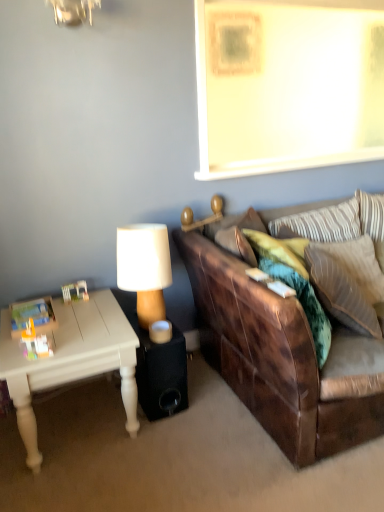
Locate an element on the screen. white painted wood coffee table at lower left is located at coordinates (71, 360).

The width and height of the screenshot is (384, 512). What do you see at coordinates (71, 360) in the screenshot?
I see `white painted wood coffee table at lower left` at bounding box center [71, 360].

This screenshot has width=384, height=512. What do you see at coordinates (323, 223) in the screenshot?
I see `striped fabric pillow at upper right, the 1th pillow positioned from the back` at bounding box center [323, 223].

You are a GUI agent. You are given a task and a screenshot of the screen. Output one action in this format:
    pyautogui.click(x=<x>, y=<y>)
    Task: Click on the velvet green pillow at right, the second pillow from the back
    The height and width of the screenshot is (512, 384).
    Given the screenshot: What is the action you would take?
    pyautogui.click(x=348, y=282)

Where is `wooden lampshade at center, the 2th lamp when ordered from right to left`? wooden lampshade at center, the 2th lamp when ordered from right to left is located at coordinates (145, 268).

Locate an element on the screen. This screenshot has width=384, height=512. lamp behind the black fabric speaker at lower center is located at coordinates (204, 218).

Is black fabric speaker at lower center positioned before wooden lampshade at upper center, the first lamp when ordered from top to bottom?

Yes, it is.

Who is smaller, black fabric speaker at lower center or wooden lampshade at upper center, the 2th lamp in the bottom-to-top sequence?

wooden lampshade at upper center, the 2th lamp in the bottom-to-top sequence.

From the image's perspective, is velvet green pillow at right, the second pillow from the back, below wooden lampshade at upper center, the 2th lamp in the bottom-to-top sequence?

Yes.

Based on their positions, is velvet green pillow at right, positioned as the second pillow in front-to-back order, located to the left or right of wooden lampshade at upper center, the first lamp when ordered from top to bottom?

Based on their positions, velvet green pillow at right, positioned as the second pillow in front-to-back order, is located to the right of wooden lampshade at upper center, the first lamp when ordered from top to bottom.

Is velvet green pillow at right, the second pillow from the back, in front of or behind wooden lampshade at upper center, which is the 1th lamp in right-to-left order, in the image?

Visually, velvet green pillow at right, the second pillow from the back, is located in front of wooden lampshade at upper center, which is the 1th lamp in right-to-left order.

Where is `the 1st pillow in front of the wooden lampshade at upper center, the first lamp when ordered from top to bottom, counting from the anchor's position`? The height and width of the screenshot is (512, 384). the 1st pillow in front of the wooden lampshade at upper center, the first lamp when ordered from top to bottom, counting from the anchor's position is located at coordinates (348, 282).

Is velvet green pillow at center, the third pillow from the back, aimed at wooden lampshade at upper center, the 2th lamp in the bottom-to-top sequence?

No, velvet green pillow at center, the third pillow from the back, is not aimed at wooden lampshade at upper center, the 2th lamp in the bottom-to-top sequence.

Considering the points (248, 233) and (222, 214), which point is behind, point (248, 233) or point (222, 214)?

The point (222, 214) is farther from the camera.

What's the angular difference between velvet green pillow at center, the third pillow from the back, and wooden lampshade at upper center, which is the 1th lamp in right-to-left order,'s facing directions?

The angular difference between velvet green pillow at center, the third pillow from the back, and wooden lampshade at upper center, which is the 1th lamp in right-to-left order, is 34.4 degrees.

How far apart are velvet green pillow at center, acting as the first pillow starting from the front, and wooden lampshade at upper center, which is the 1th lamp in right-to-left order?

The distance of velvet green pillow at center, acting as the first pillow starting from the front, from wooden lampshade at upper center, which is the 1th lamp in right-to-left order, is 20.26 inches.

Which object is thinner, wooden lampshade at center, the 2th lamp when ordered from right to left, or striped fabric pillow at upper right, the 3th pillow in the front-to-back sequence?

striped fabric pillow at upper right, the 3th pillow in the front-to-back sequence, is thinner.

From a real-world perspective, is wooden lampshade at center, the first lamp from the left, over striped fabric pillow at upper right, the 3th pillow in the front-to-back sequence?

Actually, wooden lampshade at center, the first lamp from the left, is physically below striped fabric pillow at upper right, the 3th pillow in the front-to-back sequence, in the real world.

From the image's perspective, which one is positioned lower, wooden lampshade at center, the first lamp from the left, or striped fabric pillow at upper right, the 1th pillow positioned from the back?

wooden lampshade at center, the first lamp from the left, from the image's perspective.

Which object is closer to the camera taking this photo, wooden lampshade at center, which is the 2th lamp from top to bottom, or striped fabric pillow at upper right, the 3th pillow in the front-to-back sequence?

wooden lampshade at center, which is the 2th lamp from top to bottom, is more forward.

Is velvet green pillow at center, acting as the first pillow starting from the front, placed right next to wooden lampshade at center, which is the 2th lamp from top to bottom?

No, velvet green pillow at center, acting as the first pillow starting from the front, is not beside wooden lampshade at center, which is the 2th lamp from top to bottom.

Considering the relative sizes of velvet green pillow at center, acting as the first pillow starting from the front, and wooden lampshade at center, which is the 2th lamp from top to bottom, in the image provided, is velvet green pillow at center, acting as the first pillow starting from the front, taller than wooden lampshade at center, which is the 2th lamp from top to bottom,?

Indeed, velvet green pillow at center, acting as the first pillow starting from the front, has a greater height compared to wooden lampshade at center, which is the 2th lamp from top to bottom.

Between velvet green pillow at center, acting as the first pillow starting from the front, and wooden lampshade at center, the first lamp from the left, which one is positioned in front?

velvet green pillow at center, acting as the first pillow starting from the front.

Can you confirm if velvet green pillow at center, the third pillow from the back, is wider than wooden lampshade at center, the first lamp from the left?

Correct, the width of velvet green pillow at center, the third pillow from the back, exceeds that of wooden lampshade at center, the first lamp from the left.

Which of these two, wooden lampshade at upper center, positioned as the second lamp in left-to-right order, or striped fabric pillow at upper right, the 3th pillow in the front-to-back sequence, is thinner?

wooden lampshade at upper center, positioned as the second lamp in left-to-right order, is thinner.

In the image, is wooden lampshade at upper center, positioned as the second lamp in left-to-right order, positioned in front of or behind striped fabric pillow at upper right, the 3th pillow in the front-to-back sequence?

wooden lampshade at upper center, positioned as the second lamp in left-to-right order, is positioned closer to the viewer than striped fabric pillow at upper right, the 3th pillow in the front-to-back sequence.

From a real-world perspective, between wooden lampshade at upper center, the 2th lamp in the bottom-to-top sequence, and striped fabric pillow at upper right, the 3th pillow in the front-to-back sequence, who is vertically lower?

striped fabric pillow at upper right, the 3th pillow in the front-to-back sequence, from a real-world perspective.

Does wooden lampshade at center, the first lamp from the left, have a greater width compared to white painted wood coffee table at lower left?

No.

Does wooden lampshade at center, which is the 2th lamp from top to bottom, appear on the right side of white painted wood coffee table at lower left?

Yes, wooden lampshade at center, which is the 2th lamp from top to bottom, is to the right of white painted wood coffee table at lower left.

In the scene shown: Considering the sizes of objects wooden lampshade at center, the first lamp from the left, and white painted wood coffee table at lower left in the image provided, who is shorter, wooden lampshade at center, the first lamp from the left, or white painted wood coffee table at lower left?

With less height is wooden lampshade at center, the first lamp from the left.

Can you tell me how much wooden lampshade at center, arranged as the 1th lamp when ordered from the bottom, and white painted wood coffee table at lower left differ in facing direction?

The angle between the facing direction of wooden lampshade at center, arranged as the 1th lamp when ordered from the bottom, and the facing direction of white painted wood coffee table at lower left is 1.58 degrees.

Find the location of `side table in front of the wooden lampshade at upper center, the first lamp when ordered from top to bottom`. side table in front of the wooden lampshade at upper center, the first lamp when ordered from top to bottom is located at coordinates (157, 366).

From the image's perspective, starting from the wooden lampshade at upper center, the 2th lamp in the bottom-to-top sequence, which pillow is the 2nd one below? Please provide its 2D coordinates.

[(348, 282)]

Considering their positions, is wooden lampshade at center, which is the 2th lamp from top to bottom, positioned closer to wooden lampshade at upper center, the 2th lamp in the bottom-to-top sequence, than velvet green pillow at right, the second pillow from the back?

wooden lampshade at center, which is the 2th lamp from top to bottom.

When comparing their distances from velvet green pillow at center, the third pillow from the back, does black fabric speaker at lower center or white painted wood coffee table at lower left seem closer?

black fabric speaker at lower center lies closer to velvet green pillow at center, the third pillow from the back, than the other object.

Looking at the image, which one is located closer to velvet green pillow at right, positioned as the second pillow in front-to-back order, wooden lampshade at upper center, positioned as the second lamp in left-to-right order, or wooden lampshade at center, arranged as the 1th lamp when ordered from the bottom?

The object closer to velvet green pillow at right, positioned as the second pillow in front-to-back order, is wooden lampshade at upper center, positioned as the second lamp in left-to-right order.

Looking at the image, which one is located further to wooden lampshade at upper center, which is the 1th lamp in right-to-left order, black fabric speaker at lower center or velvet green pillow at center, the third pillow from the back?

black fabric speaker at lower center lies further to wooden lampshade at upper center, which is the 1th lamp in right-to-left order, than the other object.

From the image, which object appears to be nearer to wooden lampshade at center, which is the 2th lamp from top to bottom, leather couch at right or wooden lampshade at upper center, the 2th lamp in the bottom-to-top sequence?

wooden lampshade at upper center, the 2th lamp in the bottom-to-top sequence.

When comparing their distances from striped fabric pillow at upper right, the 1th pillow positioned from the back, does black fabric speaker at lower center or leather couch at right seem closer?

leather couch at right.

Looking at the image, which one is located closer to velvet green pillow at center, acting as the first pillow starting from the front, striped fabric pillow at upper right, the 1th pillow positioned from the back, or black fabric speaker at lower center?

striped fabric pillow at upper right, the 1th pillow positioned from the back, is closer to velvet green pillow at center, acting as the first pillow starting from the front.

When comparing their distances from striped fabric pillow at upper right, the 1th pillow positioned from the back, does white painted wood coffee table at lower left or velvet green pillow at right, positioned as the second pillow in front-to-back order, seem closer?

velvet green pillow at right, positioned as the second pillow in front-to-back order, is positioned closer to the anchor striped fabric pillow at upper right, the 1th pillow positioned from the back.

The height and width of the screenshot is (512, 384). What are the coordinates of `lamp between wooden lampshade at center, arranged as the 1th lamp when ordered from the bottom, and leather couch at right from left to right` in the screenshot? It's located at (204, 218).

Where is `lamp between wooden lampshade at center, the first lamp from the left, and velvet green pillow at right, positioned as the second pillow in front-to-back order, from left to right`? This screenshot has height=512, width=384. lamp between wooden lampshade at center, the first lamp from the left, and velvet green pillow at right, positioned as the second pillow in front-to-back order, from left to right is located at coordinates (204, 218).

Find the location of a particular element. The width and height of the screenshot is (384, 512). side table located between wooden lampshade at center, the 2th lamp when ordered from right to left, and striped fabric pillow at upper right, the 1th pillow positioned from the back, in the left-right direction is located at coordinates (157, 366).

I want to click on pillow located between black fabric speaker at lower center and striped fabric pillow at upper right, the 1th pillow positioned from the back, in the left-right direction, so click(x=294, y=282).